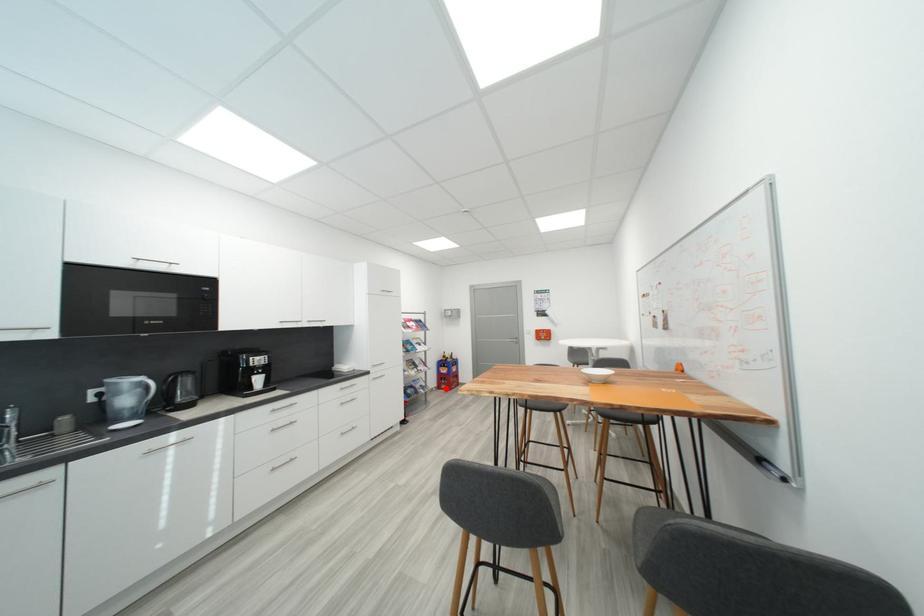
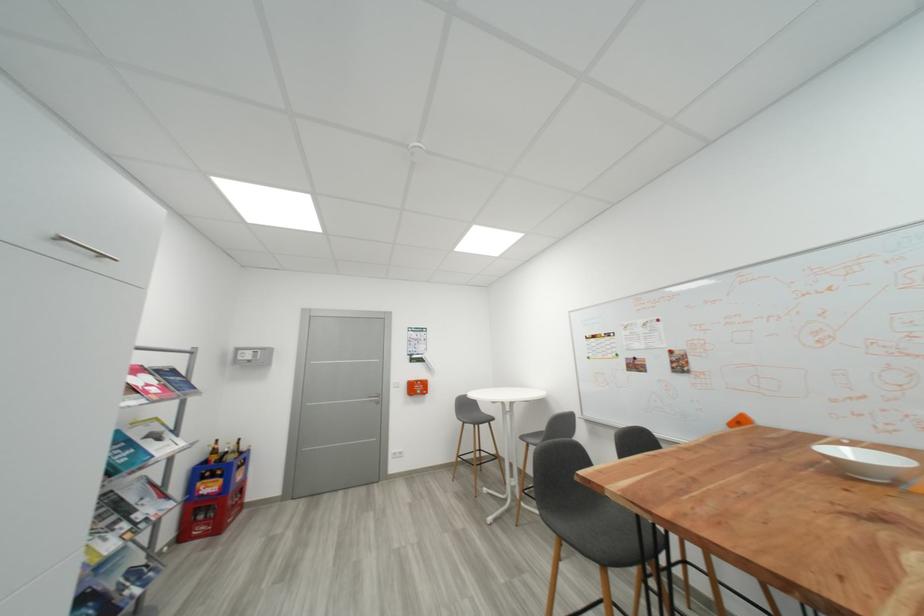
Question: I am providing you with two images of the same scene from different viewpoints. In image1, a red point is highlighted. Considering the same 3D point in image2, which of the following is correct?

Choices:
 (A) It is closer
 (B) It is farther

Answer: (A)